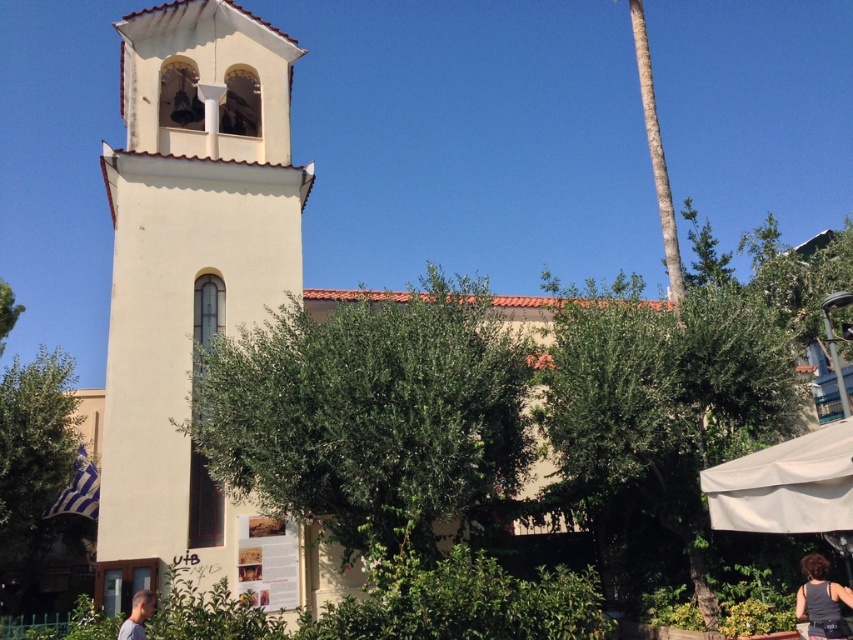
Question: Estimate the real-world distances between objects in this image. Which object is closer to the white stucco bell tower at left?

Choices:
 (A) blonde hair at lower left
 (B) white fabric canopy at lower right
 (C) green textured palm tree at upper right

Answer: (A)

Question: Does white stucco bell tower at left appear under black fabric tank top at lower right?

Choices:
 (A) yes
 (B) no

Answer: (B)

Question: Considering the real-world distances, which object is farthest from the white stucco bell tower at left?

Choices:
 (A) green textured palm tree at upper right
 (B) white stucco church at center

Answer: (A)

Question: Is white stucco church at center positioned in front of black fabric tank top at lower right?

Choices:
 (A) yes
 (B) no

Answer: (B)

Question: Is white stucco bell tower at left thinner than green textured palm tree at upper right?

Choices:
 (A) yes
 (B) no

Answer: (A)

Question: Which object is positioned farthest from the blonde hair at lower left?

Choices:
 (A) black fabric tank top at lower right
 (B) white stucco bell tower at left
 (C) green textured palm tree at upper right

Answer: (C)